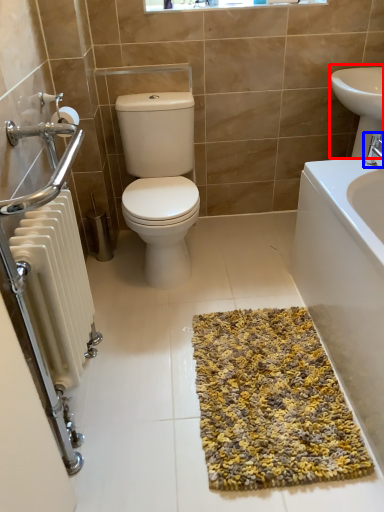
Question: Which point is further to the camera, sink (highlighted by a red box) or tap (highlighted by a blue box)?

Choices:
 (A) sink
 (B) tap

Answer: (A)